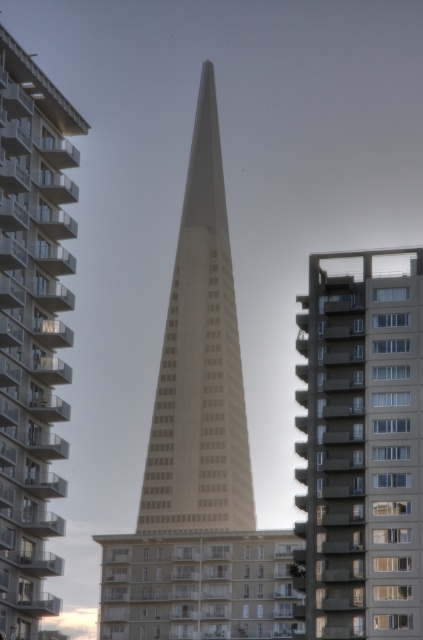
Question: Observing the image, what is the correct spatial positioning of concrete building at center in reference to beige concrete tower at center?

Choices:
 (A) right
 (B) left

Answer: (A)

Question: Can you confirm if concrete building at center is positioned to the left of beige concrete tower at center?

Choices:
 (A) no
 (B) yes

Answer: (A)

Question: Which point is closer to the camera taking this photo?

Choices:
 (A) (231, 298)
 (B) (16, 442)
 (C) (308, 625)

Answer: (B)

Question: Estimate the real-world distances between objects in this image. Which object is closer to the concrete building at center?

Choices:
 (A) beige concrete tower at center
 (B) white concrete spire at center

Answer: (A)

Question: Which point is farther to the camera?

Choices:
 (A) concrete building at center
 (B) white concrete spire at center
 (C) beige concrete tower at center

Answer: (B)

Question: Can you confirm if concrete building at center is positioned below beige concrete tower at center?

Choices:
 (A) yes
 (B) no

Answer: (A)